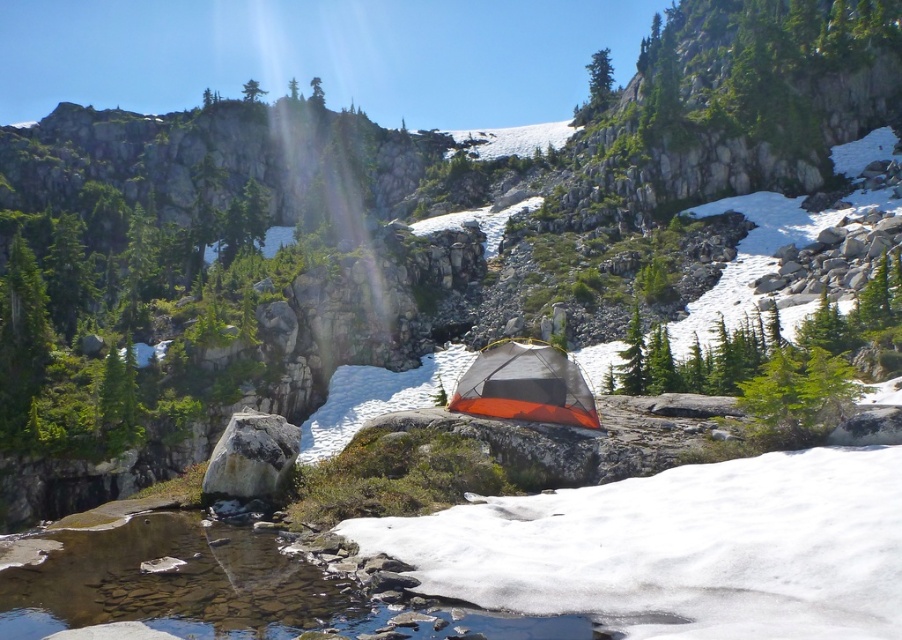
Question: Which object appears farthest from the camera in this image?

Choices:
 (A) white fluffy snow at center
 (B) orange mesh tent at center

Answer: (B)

Question: Which point is farther to the camera?

Choices:
 (A) orange mesh tent at center
 (B) white fluffy snow at center
 (C) clear water at creek center
 (D) gray rock at center

Answer: (A)

Question: Is clear water at creek center to the left of orange mesh tent at center from the viewer's perspective?

Choices:
 (A) no
 (B) yes

Answer: (B)

Question: Does white fluffy snow at center come behind orange mesh tent at center?

Choices:
 (A) yes
 (B) no

Answer: (B)

Question: Does clear water at creek center appear over gray rock at center?

Choices:
 (A) no
 (B) yes

Answer: (A)

Question: Which point is farther to the camera?

Choices:
 (A) orange mesh tent at center
 (B) gray rock at center

Answer: (A)